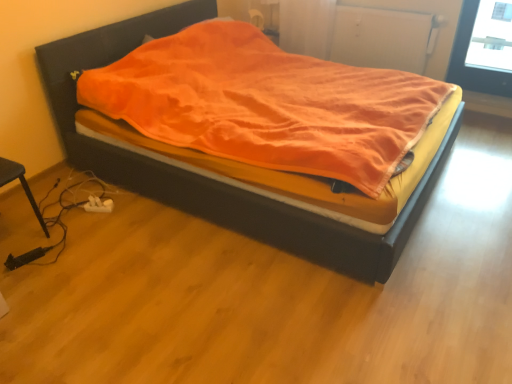
Describe the element at coordinates (198, 176) in the screenshot. The height and width of the screenshot is (384, 512). I see `velvet orange blanket at center` at that location.

This screenshot has width=512, height=384. Identify the location of velvet orange blanket at center. (198, 176).

This screenshot has width=512, height=384. In order to click on velvet orange blanket at center in this screenshot , I will do `click(198, 176)`.